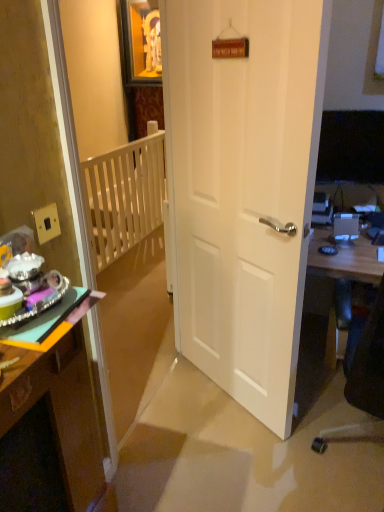
This screenshot has height=512, width=384. What are the coordinates of `vacant region under wooden desk at right (from a real-world perspective)` in the screenshot? It's located at (322, 364).